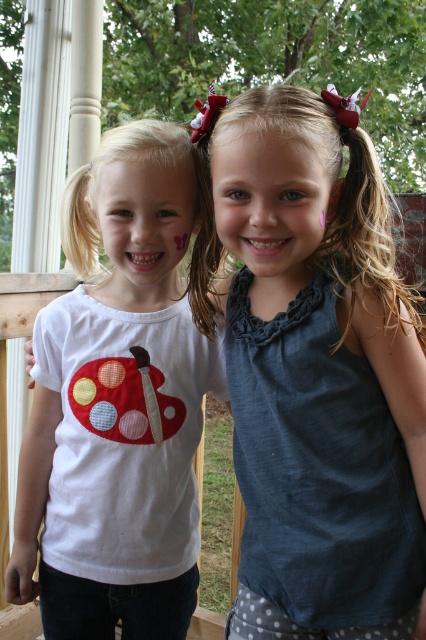
Between point (377, 554) and point (172, 556), which one is positioned in front?

Point (377, 554) is in front.

Does blue fabric shirt at center have a larger size compared to white matte shirt with ladybug design at left?

Actually, blue fabric shirt at center might be smaller than white matte shirt with ladybug design at left.

I want to click on blue fabric shirt at center, so click(x=314, y=371).